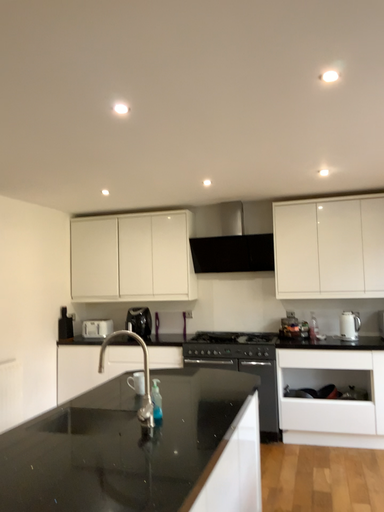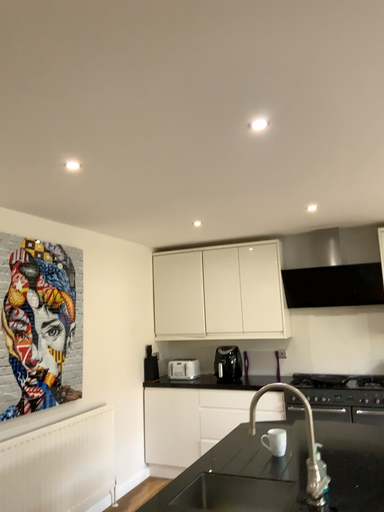
Question: Which way did the camera rotate in the video?

Choices:
 (A) rotated right
 (B) rotated left

Answer: (B)